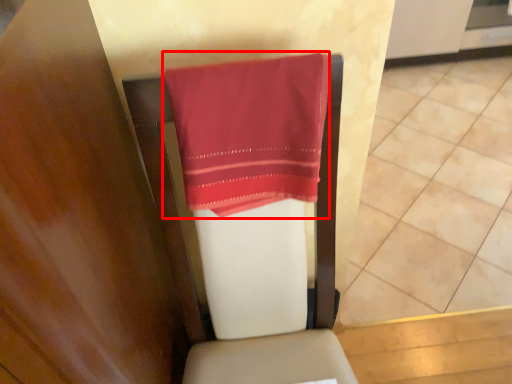
Question: From the image, what is the correct spatial relationship of towel (annotated by the red box) in relation to tile?

Choices:
 (A) left
 (B) right

Answer: (A)